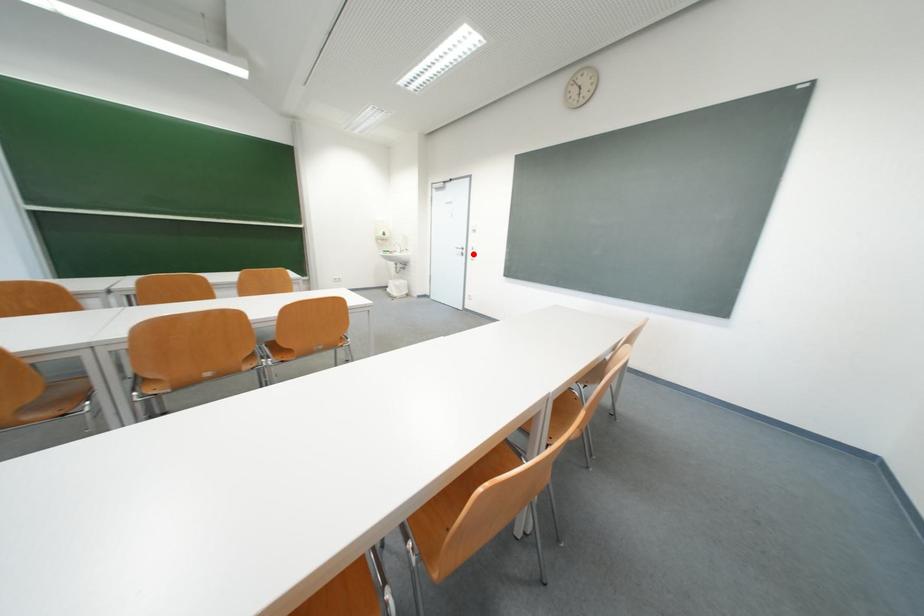
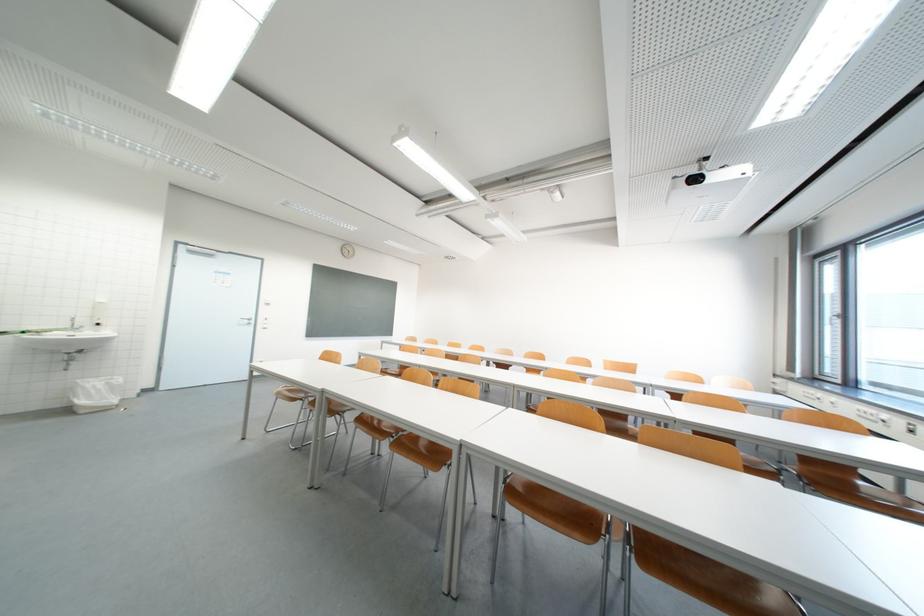
Where in the second image is the point corresponding to the highlighted location from the first image?

(261, 323)